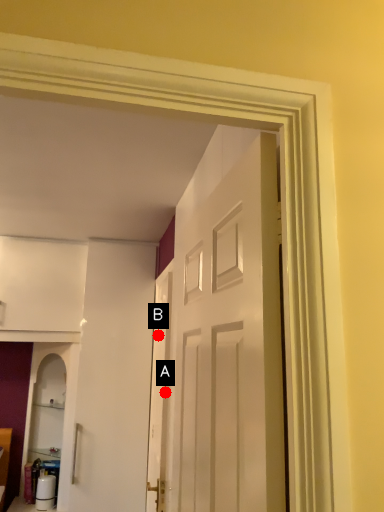
Question: Two points are circled on the image, labeled by A and B beside each circle. Which point appears farthest from the camera in this image?

Choices:
 (A) A is further
 (B) B is further

Answer: (B)